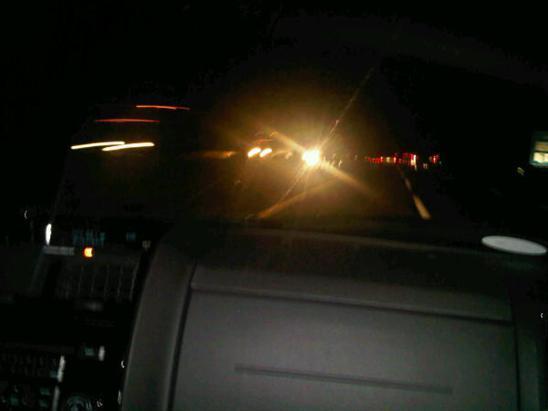
This screenshot has width=548, height=411. What are the coordinates of `light` in the screenshot? It's located at (150, 144).